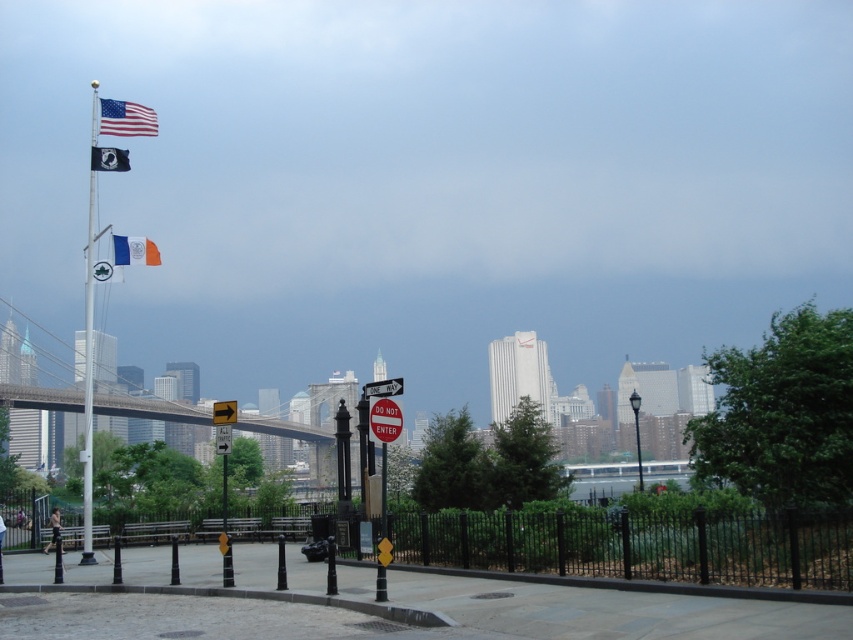
Question: Which object appears closest to the camera in this image?

Choices:
 (A) matte fabric flag at upper left
 (B) black metal fence at lower center
 (C) yellow plastic traffic sign at center

Answer: (B)

Question: Considering the relative positions of white metallic flag pole at left and blue fabric flag at upper left in the image provided, where is white metallic flag pole at left located with respect to blue fabric flag at upper left?

Choices:
 (A) left
 (B) right

Answer: (A)

Question: Which of the following is the closest to the observer?

Choices:
 (A) yellow plastic traffic light at center-right
 (B) matte fabric flag at upper left

Answer: (A)

Question: Can you confirm if white metallic flag pole at left is positioned below yellow plastic traffic light at center-right?

Choices:
 (A) yes
 (B) no

Answer: (B)

Question: Which point is closer to the camera?

Choices:
 (A) yellow plastic traffic light at center-right
 (B) white metallic flag pole at left
 (C) black metal fence at lower center

Answer: (C)

Question: Does white plastic do not enter sign at center have a lesser width compared to yellow plastic traffic sign at center?

Choices:
 (A) yes
 (B) no

Answer: (A)